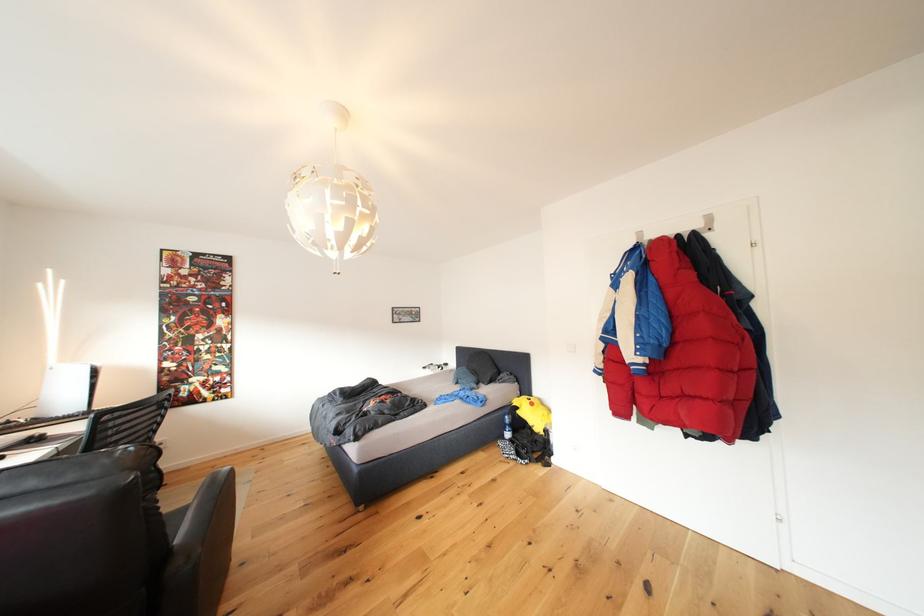
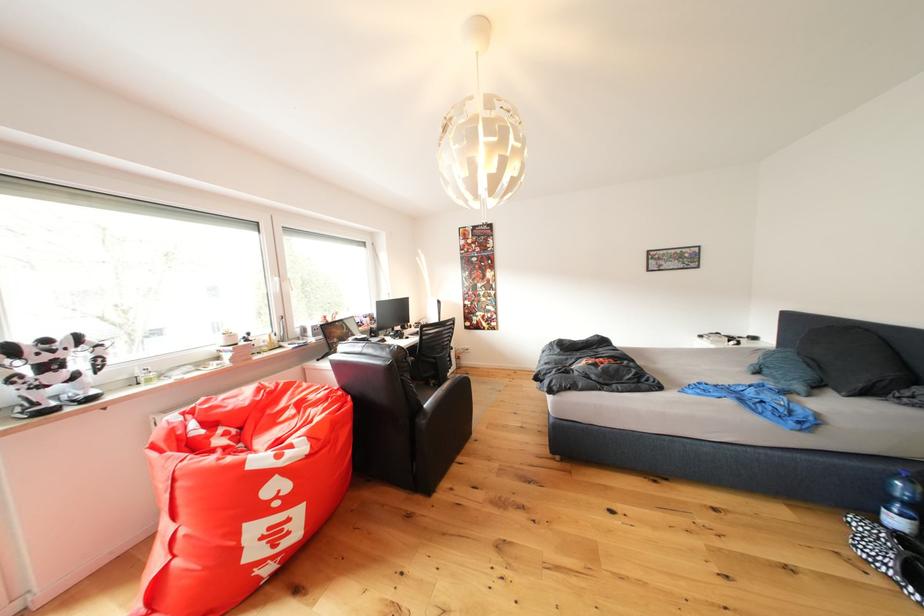
Question: I am providing you with two images of the same scene from different viewpoints. Which of the following objects are not visible in image2?

Choices:
 (A) dotted slippers
 (B) white window handle
 (C) black chair sitting surface
 (D) none of these

Answer: (D)